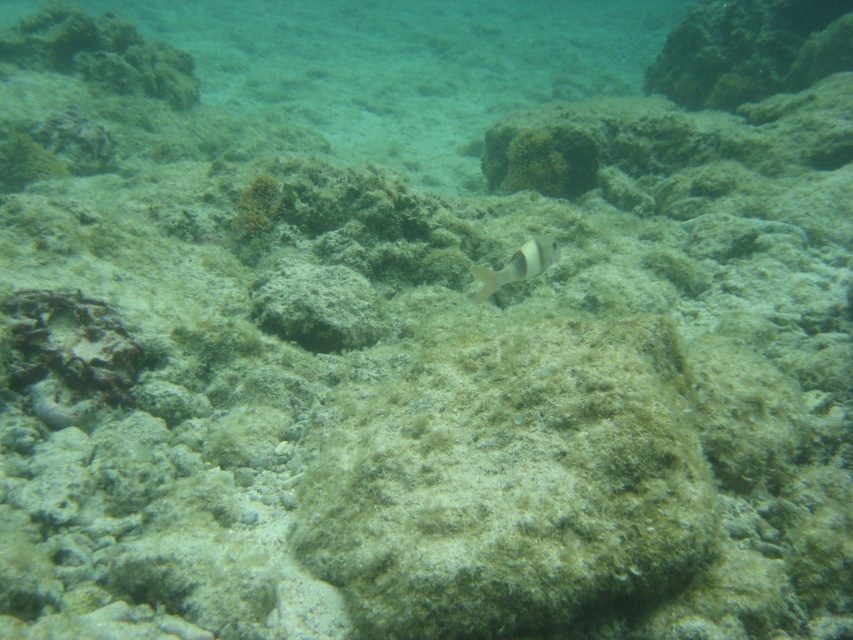
Question: Is smooth gray rock at center bigger than white matte fish at center?

Choices:
 (A) yes
 (B) no

Answer: (A)

Question: Which point appears closest to the camera in this image?

Choices:
 (A) (556, 257)
 (B) (334, 310)

Answer: (A)

Question: Which point appears farthest from the camera in this image?

Choices:
 (A) (506, 260)
 (B) (260, 275)

Answer: (A)

Question: Does smooth gray rock at center appear under white matte fish at center?

Choices:
 (A) yes
 (B) no

Answer: (A)

Question: Can you confirm if smooth gray rock at center is positioned above white matte fish at center?

Choices:
 (A) no
 (B) yes

Answer: (A)